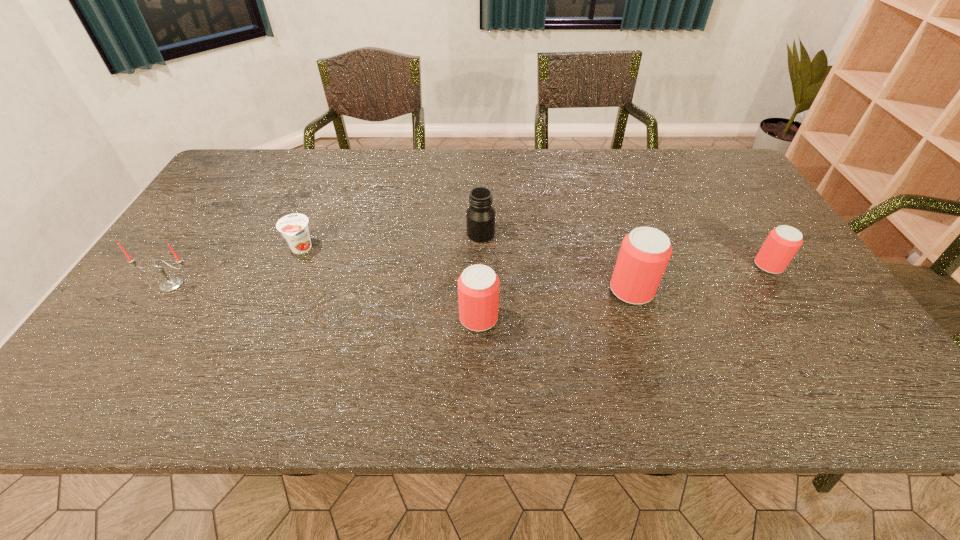
Locate an element on the screen. The height and width of the screenshot is (540, 960). vacant space at the right edge of the desktop is located at coordinates (826, 303).

Image resolution: width=960 pixels, height=540 pixels. In order to click on free space at the far right corner in this screenshot , I will do `click(734, 169)`.

This screenshot has height=540, width=960. I want to click on free space between the shortest object and the rightmost object, so click(x=535, y=257).

Locate an element on the screen. The image size is (960, 540). free space between the jar and the tallest beer can is located at coordinates (556, 262).

In order to click on vacant point located between the leftmost beer can and the yogurt in this screenshot , I will do `click(390, 284)`.

What are the coordinates of `free space between the leftmost object and the leftmost beer can` in the screenshot? It's located at [325, 301].

The width and height of the screenshot is (960, 540). I want to click on vacant point located between the second beer can from right to left and the leftmost object, so click(x=402, y=287).

At what (x,y) coordinates should I click in order to perform the action: click on unoccupied position between the jar and the shortest object. Please return your answer as a coordinate pair (x, y). Image resolution: width=960 pixels, height=540 pixels. Looking at the image, I should click on (391, 241).

You are a GUI agent. You are given a task and a screenshot of the screen. Output one action in this format:
    pyautogui.click(x=<x>, y=<y>)
    Task: Click on the fourth closest object to the shortest beer can
    This screenshot has height=540, width=960.
    Given the screenshot: What is the action you would take?
    pyautogui.click(x=294, y=227)

In order to click on object identified as the fourth closest to the candle in this screenshot , I will do `click(645, 252)`.